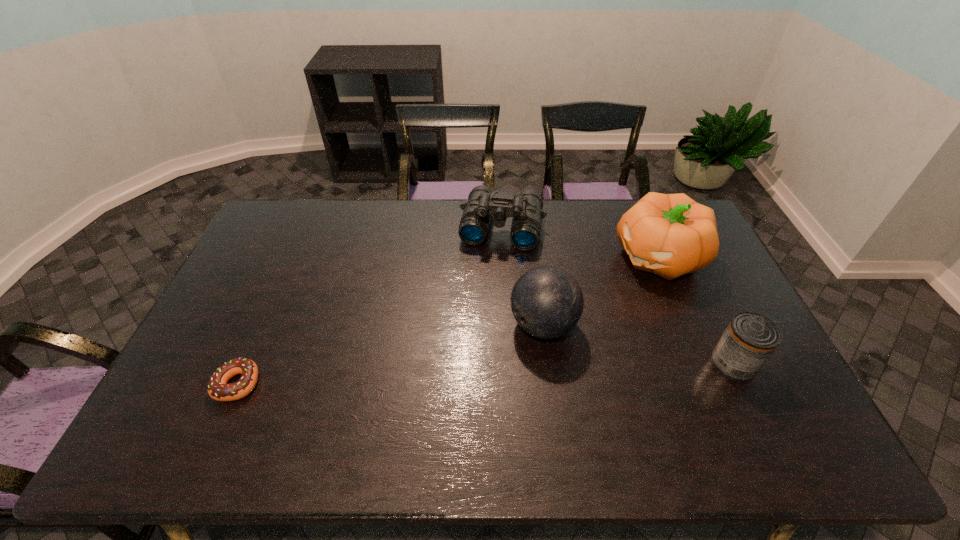
The image size is (960, 540). Find the location of `object that is the third nearest to the can`. object that is the third nearest to the can is located at coordinates (483, 203).